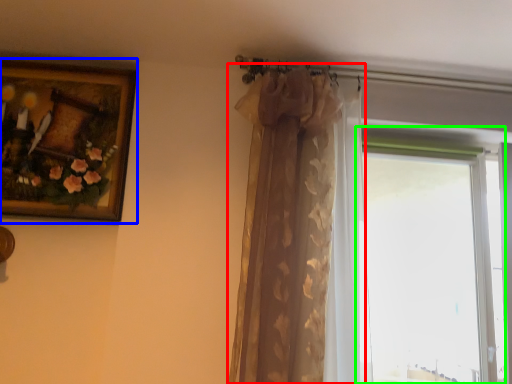
Question: Considering the real-world distances, which object is closest to curtain (highlighted by a red box)? picture frame (highlighted by a blue box) or window (highlighted by a green box).

Choices:
 (A) picture frame
 (B) window

Answer: (A)